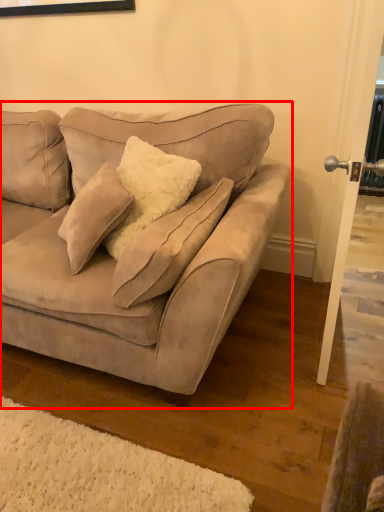
Question: From the image's perspective, what is the correct spatial positioning of studio couch (annotated by the red box) in reference to screen door?

Choices:
 (A) above
 (B) below

Answer: (B)